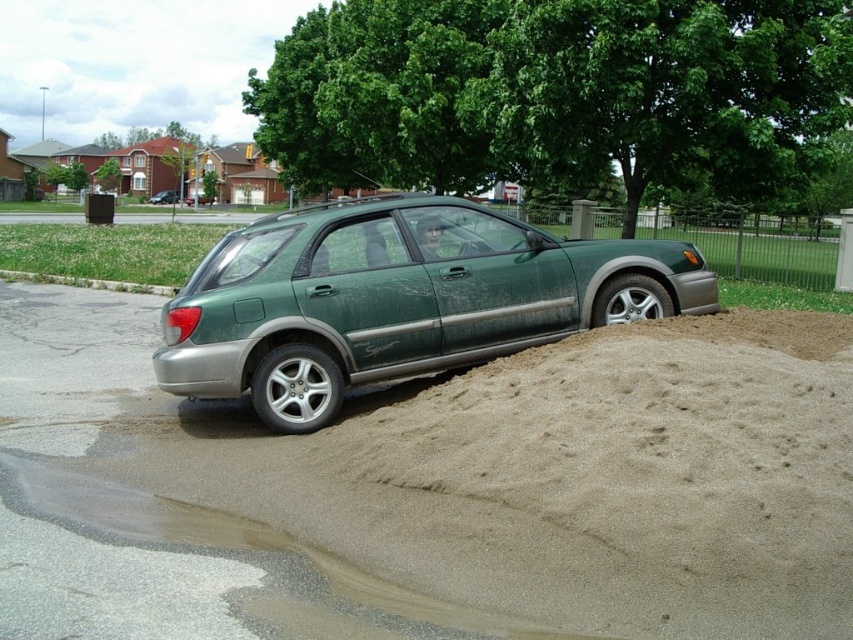
The height and width of the screenshot is (640, 853). What do you see at coordinates (398, 300) in the screenshot?
I see `green matte car at center` at bounding box center [398, 300].

You are a GUI agent. You are given a task and a screenshot of the screen. Output one action in this format:
    pyautogui.click(x=<x>, y=<y>)
    Task: Click on the green matte car at center
    The height and width of the screenshot is (640, 853).
    Given the screenshot: What is the action you would take?
    pyautogui.click(x=398, y=300)

Locate an element on the screen. This screenshot has width=853, height=640. green matte car at center is located at coordinates (398, 300).

Between gray concrete curb at lower left and green matte hatchback at center, which one is positioned lower?

gray concrete curb at lower left is lower down.

What do you see at coordinates (88, 282) in the screenshot? This screenshot has height=640, width=853. I see `gray concrete curb at lower left` at bounding box center [88, 282].

The height and width of the screenshot is (640, 853). Identify the location of gray concrete curb at lower left. (88, 282).

Does green matte car at center have a smaller size compared to green matte hatchback at center?

Correct, green matte car at center occupies less space than green matte hatchback at center.

Can you confirm if green matte car at center is bigger than green matte hatchback at center?

No.

Is point (308, 307) more distant than point (167, 193)?

No, (308, 307) is closer to viewer.

You are a GUI agent. You are given a task and a screenshot of the screen. Output one action in this format:
    pyautogui.click(x=<x>, y=<y>)
    Task: Click on the green matte car at center
    This screenshot has height=640, width=853.
    Given the screenshot: What is the action you would take?
    pyautogui.click(x=398, y=300)